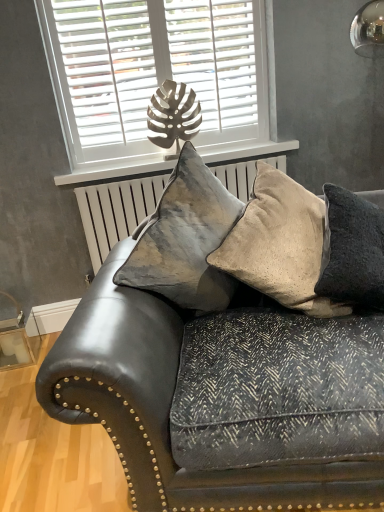
Question: In terms of width, does white matte window at upper center look wider or thinner when compared to leather couch at center?

Choices:
 (A) thin
 (B) wide

Answer: (A)

Question: From their relative heights in the image, would you say white matte window at upper center is taller or shorter than leather couch at center?

Choices:
 (A) short
 (B) tall

Answer: (B)

Question: Estimate the real-world distances between objects in this image. Which object is closer to the velvet cushion at center, which appears as the 3th pillow when viewed from the right?

Choices:
 (A) velvet beige pillow at center, which is the second pillow in right-to-left order
 (B) white matte window sill at upper center
 (C) white matte window at upper center
 (D) beige textured cushion at right, which appears as the 1th pillow when viewed from the right
 (E) leather couch at center

Answer: (A)

Question: Which object is positioned closest to the leather couch at center?

Choices:
 (A) velvet beige pillow at center, the second pillow positioned from the left
 (B) white matte window at upper center
 (C) velvet cushion at center, which appears as the 3th pillow when viewed from the right
 (D) white matte window sill at upper center
 (E) beige textured cushion at right, marked as the third pillow in a left-to-right arrangement

Answer: (C)